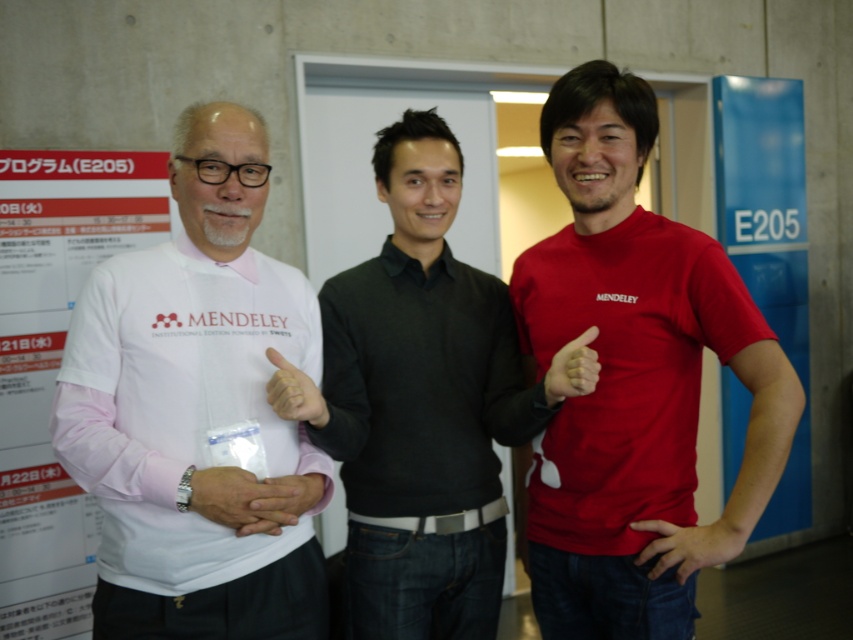
You are a photographer trying to capture a candid shot of the two subjects in the scene. You notice the white paper at left and the matte black thumb at center. Which object is closer to your camera lens? Please explain your reasoning based on their positions in the image.

The white paper at left is closer to the camera lens because it is described as being further to the viewer than the matte black thumb at center. Objects that are further to the viewer are positioned closer to the lens, making them appear nearer in the image.